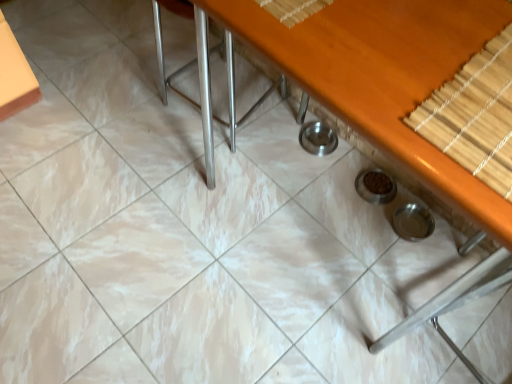
At what (x,y) coordinates should I click in order to perform the action: click on free space below wooden table at center (from a real-world perspective). Please return your answer as a coordinate pair (x, y). Looking at the image, I should click on (323, 225).